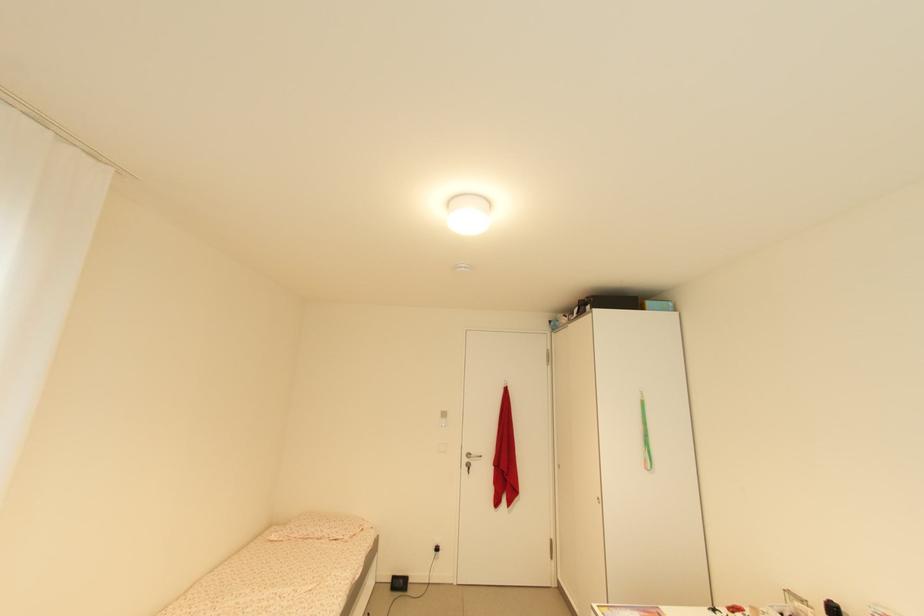
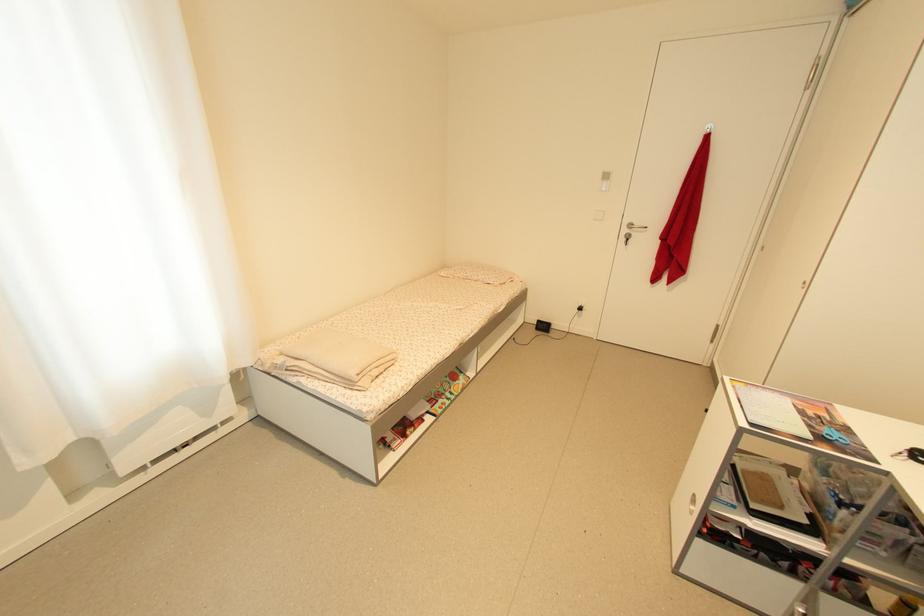
In the second image, find the point that corresponds to point 473,456 in the first image.

(636, 227)